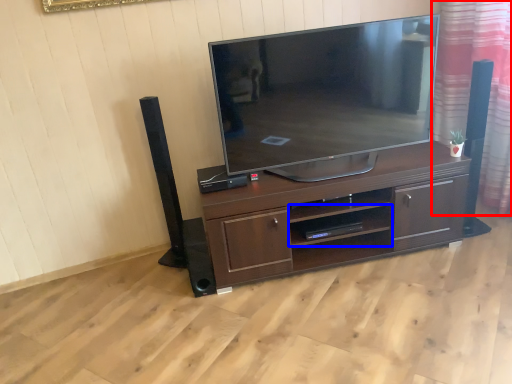
Question: Which object appears farthest to the camera in this image, curtain (highlighted by a red box) or shelf (highlighted by a blue box)?

Choices:
 (A) curtain
 (B) shelf

Answer: (B)